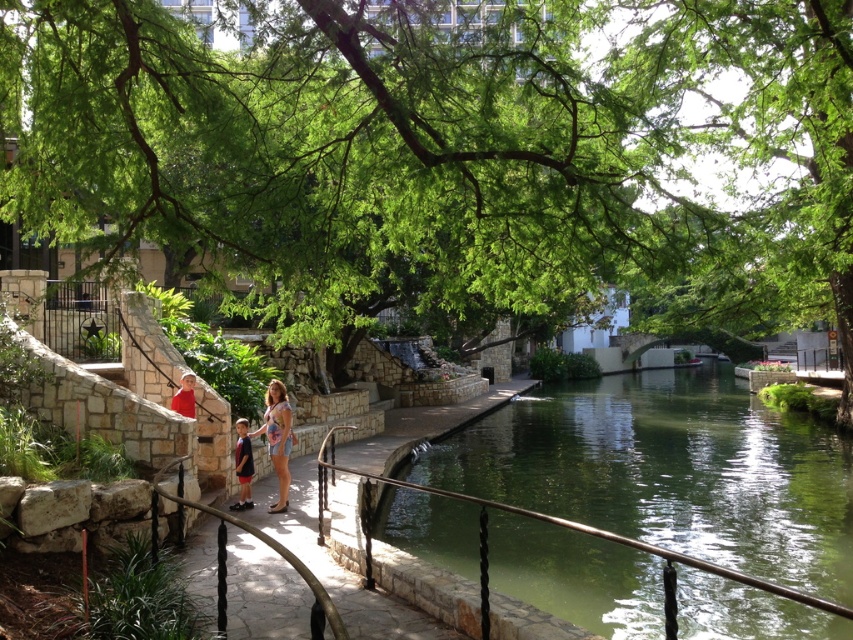
Who is positioned more to the left, floral denim shorts at center or dark blue shorts at center?

Positioned to the left is dark blue shorts at center.

This screenshot has width=853, height=640. What are the coordinates of `floral denim shorts at center` in the screenshot? It's located at (277, 438).

At what (x,y) coordinates should I click in order to perform the action: click on floral denim shorts at center. Please return your answer as a coordinate pair (x, y). This screenshot has width=853, height=640. Looking at the image, I should click on (277, 438).

Which is behind, point (560, 148) or point (277, 476)?

Point (277, 476)

Is green leafy tree at upper center positioned in front of floral denim shorts at center?

Yes, it is in front of floral denim shorts at center.

Measure the distance between green leafy tree at upper center and camera.

green leafy tree at upper center and camera are 4.50 meters apart from each other.

The width and height of the screenshot is (853, 640). Find the location of `green leafy tree at upper center`. green leafy tree at upper center is located at coordinates pyautogui.click(x=445, y=154).

Does point (767, 128) come behind point (244, 458)?

Yes, point (767, 128) is farther from viewer.

Does green leafy tree at upper center appear on the left side of dark blue shorts at center?

In fact, green leafy tree at upper center is to the right of dark blue shorts at center.

This screenshot has height=640, width=853. Identify the location of green leafy tree at upper center. (445, 154).